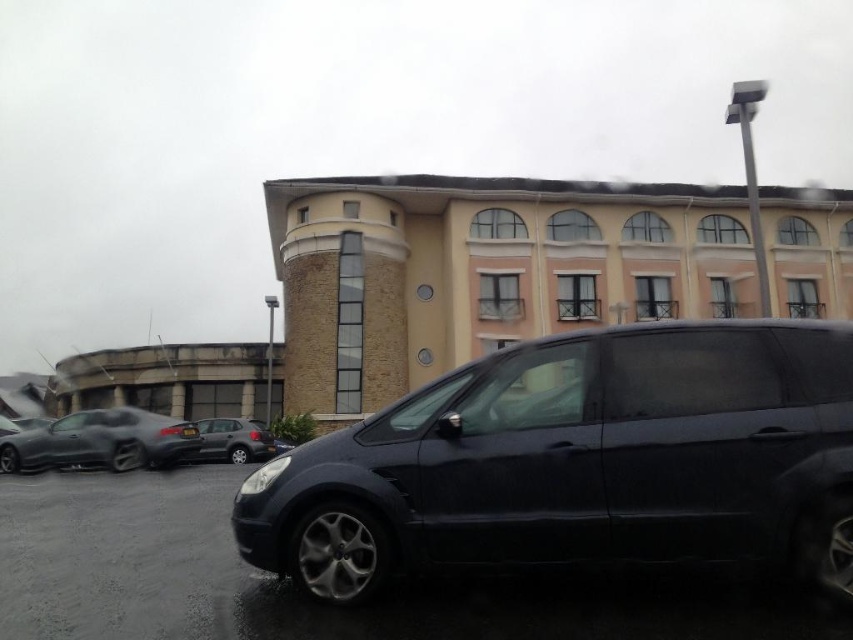
Question: Is satin black minivan at center to the left of shiny black car at left from the viewer's perspective?

Choices:
 (A) no
 (B) yes

Answer: (A)

Question: Can you confirm if satin black minivan at center is positioned to the left of satin silver hatchback at center?

Choices:
 (A) yes
 (B) no

Answer: (B)

Question: Which object is closer to the camera taking this photo?

Choices:
 (A) glossy dark blue car at lower center
 (B) satin silver hatchback at center
 (C) satin black minivan at center

Answer: (A)

Question: From the image, what is the correct spatial relationship of glossy dark blue car at lower center in relation to satin silver hatchback at center?

Choices:
 (A) below
 (B) above

Answer: (B)

Question: Among these objects, which one is nearest to the camera?

Choices:
 (A) shiny black car at left
 (B) satin black minivan at center
 (C) satin silver hatchback at center

Answer: (B)

Question: Which object is farther from the camera taking this photo?

Choices:
 (A) satin silver hatchback at center
 (B) glossy dark blue car at lower center
 (C) shiny black car at left

Answer: (A)